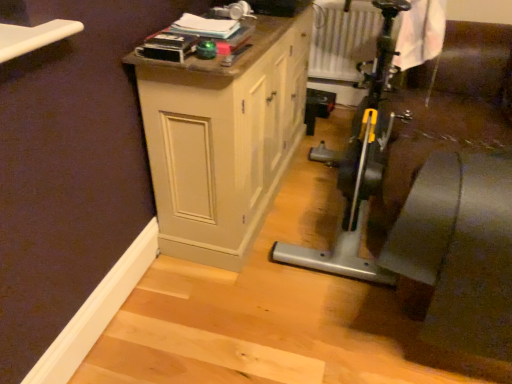
Image resolution: width=512 pixels, height=384 pixels. What do you see at coordinates (343, 39) in the screenshot?
I see `white textured radiator at upper center` at bounding box center [343, 39].

Image resolution: width=512 pixels, height=384 pixels. I want to click on white textured radiator at upper center, so click(x=343, y=39).

Where is `matte wood cabinet at center`? matte wood cabinet at center is located at coordinates (223, 138).

What do you see at coordinates (223, 138) in the screenshot? I see `matte wood cabinet at center` at bounding box center [223, 138].

In order to face matte wood cabinet at center, should I rotate leftwards or rightwards?

It's best to rotate left around 1.180 degrees.

Where is `white textured radiator at upper center`? The height and width of the screenshot is (384, 512). white textured radiator at upper center is located at coordinates (343, 39).

Is matte wood cabinet at center to the left or to the right of white textured radiator at upper center in the image?

In the image, matte wood cabinet at center appears on the left side of white textured radiator at upper center.

In the scene shown: Considering their positions, is matte wood cabinet at center located in front of or behind white textured radiator at upper center?

In the image, matte wood cabinet at center appears in front of white textured radiator at upper center.

Is point (173, 217) positioned behind point (372, 16)?

No, (173, 217) is in front of (372, 16).

From the image's perspective, is matte wood cabinet at center above white textured radiator at upper center?

Actually, matte wood cabinet at center appears below white textured radiator at upper center in the image.

From a real-world perspective, which object rests below the other?

matte wood cabinet at center is physically lower.

From the picture: Which of these two, matte wood cabinet at center or white textured radiator at upper center, is wider?

matte wood cabinet at center is wider.

Between matte wood cabinet at center and white textured radiator at upper center, which one has more height?

Standing taller between the two is matte wood cabinet at center.

Considering the relative sizes of matte wood cabinet at center and white textured radiator at upper center in the image provided, is matte wood cabinet at center bigger than white textured radiator at upper center?

Yes.

Is matte wood cabinet at center surrounding white textured radiator at upper center?

Actually, white textured radiator at upper center is outside matte wood cabinet at center.

Are matte wood cabinet at center and white textured radiator at upper center making contact?

No.

Is matte wood cabinet at center facing away from white textured radiator at upper center?

matte wood cabinet at center is not turned away from white textured radiator at upper center.

Identify the location of cabinetry below the white textured radiator at upper center (from the image's perspective). (223, 138).

Would you say white textured radiator at upper center is to the left or to the right of matte wood cabinet at center in the picture?

Based on their positions, white textured radiator at upper center is located to the right of matte wood cabinet at center.

Is the position of white textured radiator at upper center more distant than that of matte wood cabinet at center?

Answer: Yes.

Which point is more distant from viewer, (330, 39) or (255, 129)?

Point (330, 39)

From the image's perspective, is white textured radiator at upper center on matte wood cabinet at center?

Correct, white textured radiator at upper center appears higher than matte wood cabinet at center in the image.

From a real-world perspective, is white textured radiator at upper center positioned under matte wood cabinet at center based on gravity?

No.

Can you confirm if white textured radiator at upper center is wider than matte wood cabinet at center?

No, white textured radiator at upper center is not wider than matte wood cabinet at center.

Is white textured radiator at upper center shorter than matte wood cabinet at center?

Yes, white textured radiator at upper center is shorter than matte wood cabinet at center.

Looking at the image, does white textured radiator at upper center seem bigger or smaller compared to matte wood cabinet at center?

Considering their sizes, white textured radiator at upper center takes up less space than matte wood cabinet at center.

Is white textured radiator at upper center spatially inside matte wood cabinet at center, or outside of it?

white textured radiator at upper center lies outside matte wood cabinet at center.

Would you consider white textured radiator at upper center to be distant from matte wood cabinet at center?

Yes, white textured radiator at upper center is far from matte wood cabinet at center.

Is white textured radiator at upper center turned away from matte wood cabinet at center?

No, white textured radiator at upper center's orientation is not away from matte wood cabinet at center.

What's the angular difference between white textured radiator at upper center and matte wood cabinet at center's facing directions?

The angle between the facing direction of white textured radiator at upper center and the facing direction of matte wood cabinet at center is 87.5 degrees.

Where is `radiator above the matte wood cabinet at center (from the image's perspective)`? This screenshot has width=512, height=384. radiator above the matte wood cabinet at center (from the image's perspective) is located at coordinates (343, 39).

Identify the location of cabinetry lying on the left of white textured radiator at upper center. (223, 138).

Identify the location of radiator above the matte wood cabinet at center (from the image's perspective). The width and height of the screenshot is (512, 384). (343, 39).